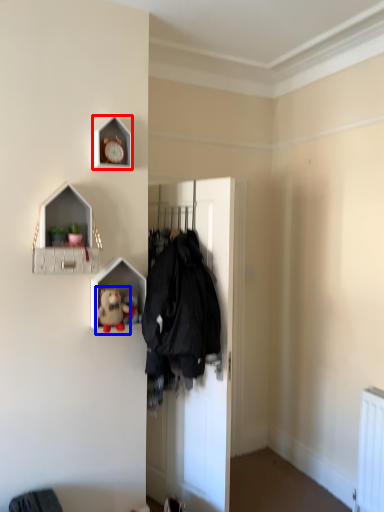
Question: Which of the following is the closest to the observer, clock (highlighted by a red box) or toy (highlighted by a blue box)?

Choices:
 (A) clock
 (B) toy

Answer: (B)